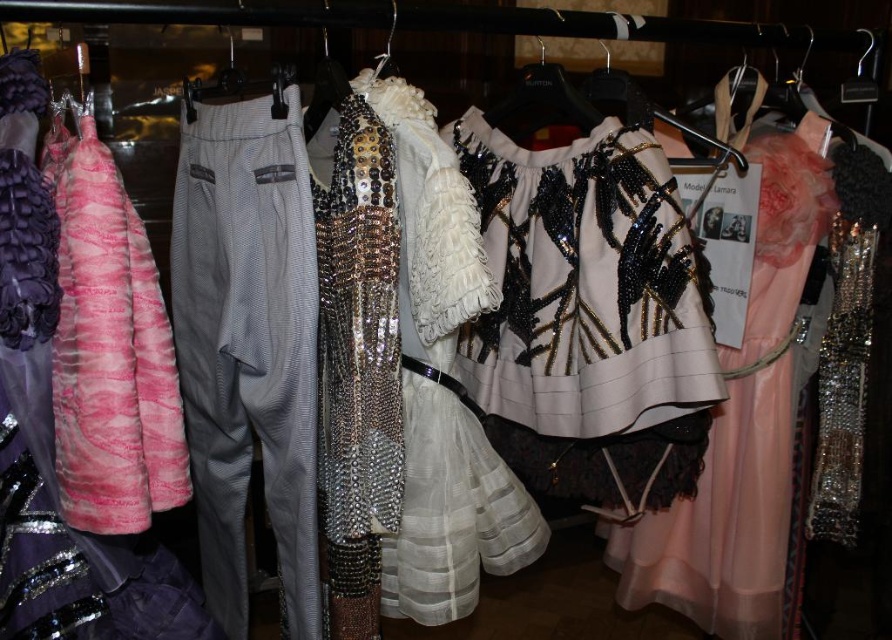
Question: Is gray textured pants at left below pink fur coat at left?

Choices:
 (A) yes
 (B) no

Answer: (A)

Question: Does gray textured pants at left appear on the right side of pale pink chiffon dress at center?

Choices:
 (A) no
 (B) yes

Answer: (A)

Question: Which is nearer to the pink fur coat at left?

Choices:
 (A) gray textured pants at left
 (B) white sequined blouse at center
 (C) pale pink chiffon dress at center

Answer: (A)

Question: Is white sequined blouse at center further to the viewer compared to gray textured pants at left?

Choices:
 (A) no
 (B) yes

Answer: (B)

Question: Which of the following is the closest to the observer?

Choices:
 (A) gray textured pants at left
 (B) pale pink chiffon dress at center
 (C) white sequined blouse at center
 (D) pink fur coat at left

Answer: (D)

Question: Which object is farther from the camera taking this photo?

Choices:
 (A) white sequined blouse at center
 (B) gray textured pants at left
 (C) pink fur coat at left

Answer: (A)